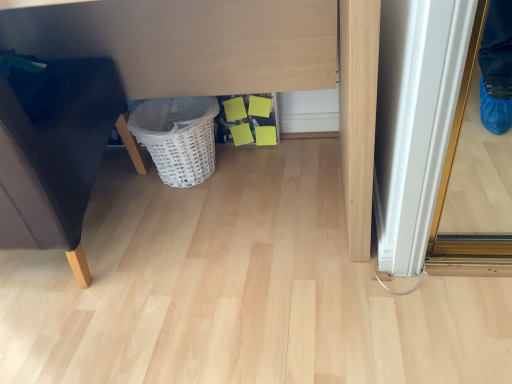
Where is `free space in front of matte white vanity at center`? This screenshot has width=512, height=384. free space in front of matte white vanity at center is located at coordinates (205, 317).